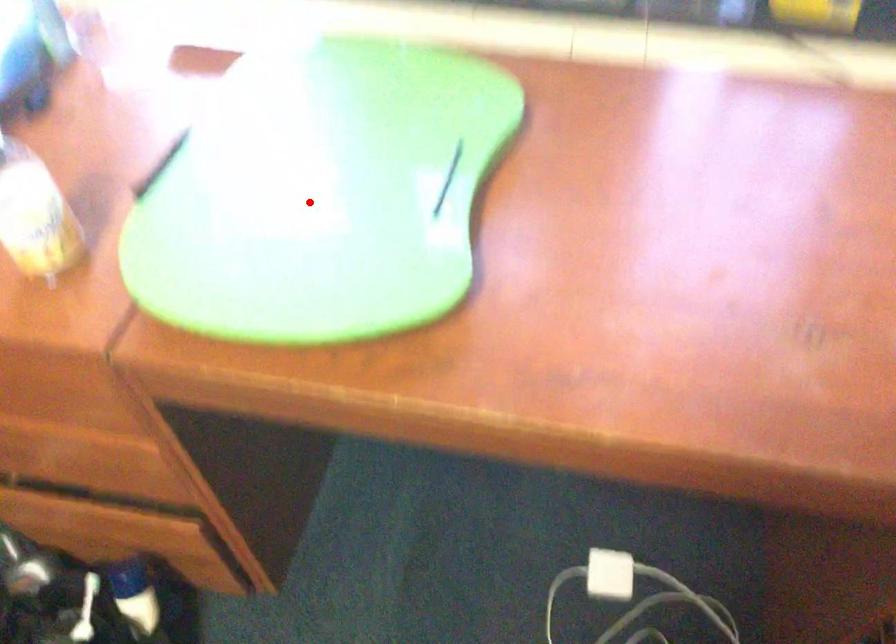
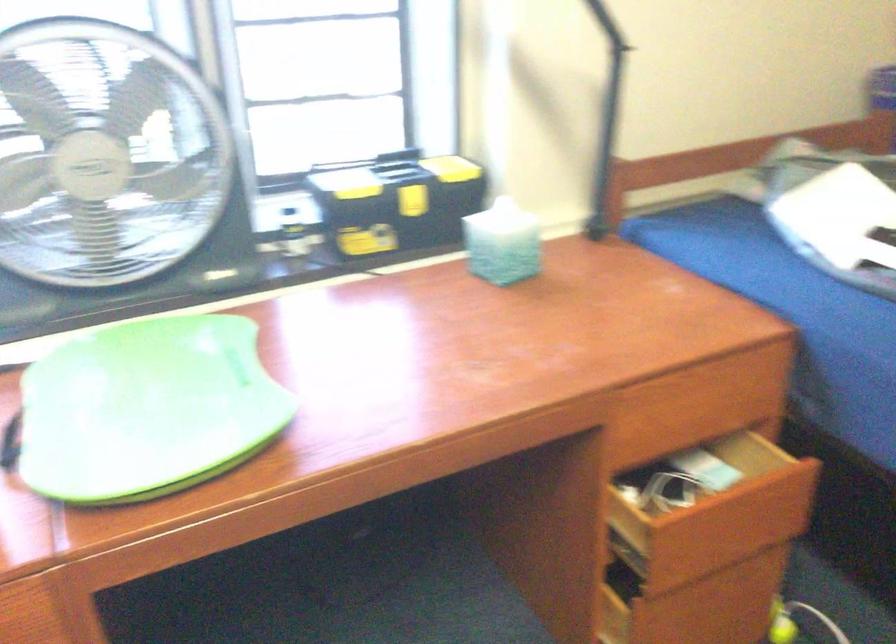
The point at the highlighted location is marked in the first image. Where is the corresponding point in the second image?

(147, 409)